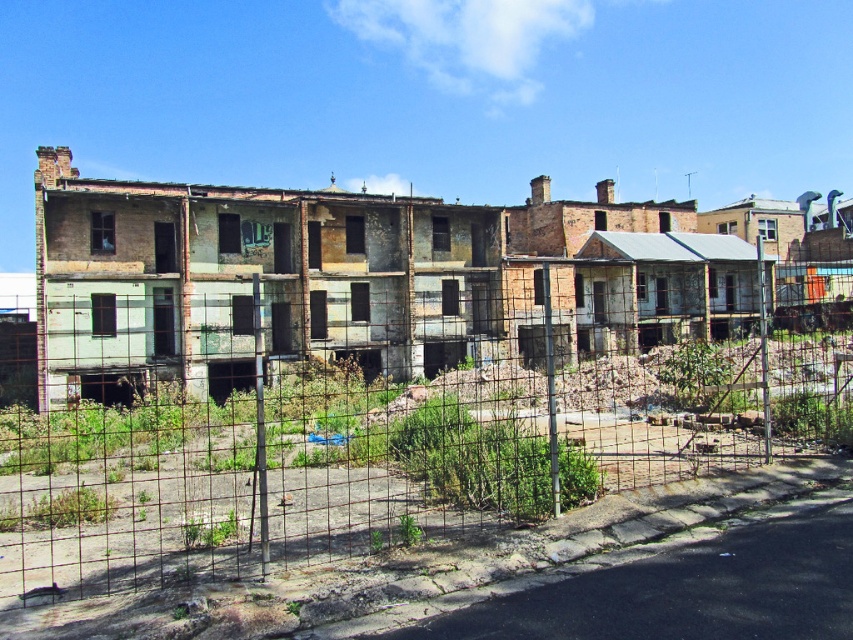
You are standing in front of the dilapidated buildings and notice two points marked on the ground. The first point is at coordinate point(x=425, y=518) and the second is at point(x=186, y=355). Which point is closer to your current position?

Point(x=425, y=518) is closer to the camera than point(x=186, y=355), so the first point is closer to your current position.

You are standing in front of the urban scene described. The rusty wire fence at center is blocking your view of the dilapidated buildings behind it. Can you see the buildings through the fence?

Yes, the rusty wire fence at center is at point (387, 454), so you can see the buildings behind it through the fence since it is partially obscuring the view, not completely blocking it.